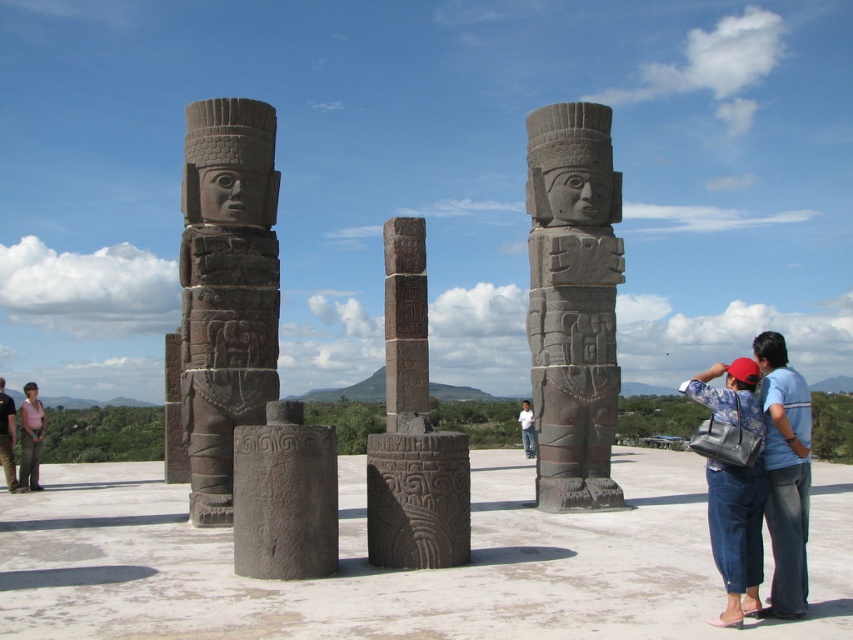
You are a tour guide explaining the historical site to visitors. You point out the gray stone column at center and the matte pink shirt at left. Which object is taller?

The matte pink shirt at left is taller than the gray stone column at center.

You are an archaeologist examining the historical site. You notice two items at the base of the statues. The blue denim jeans at lower right and the dark brown leather jacket at lower left. Which item is smaller in size?

The blue denim jeans at lower right is smaller in size compared to the dark brown leather jacket at lower left.